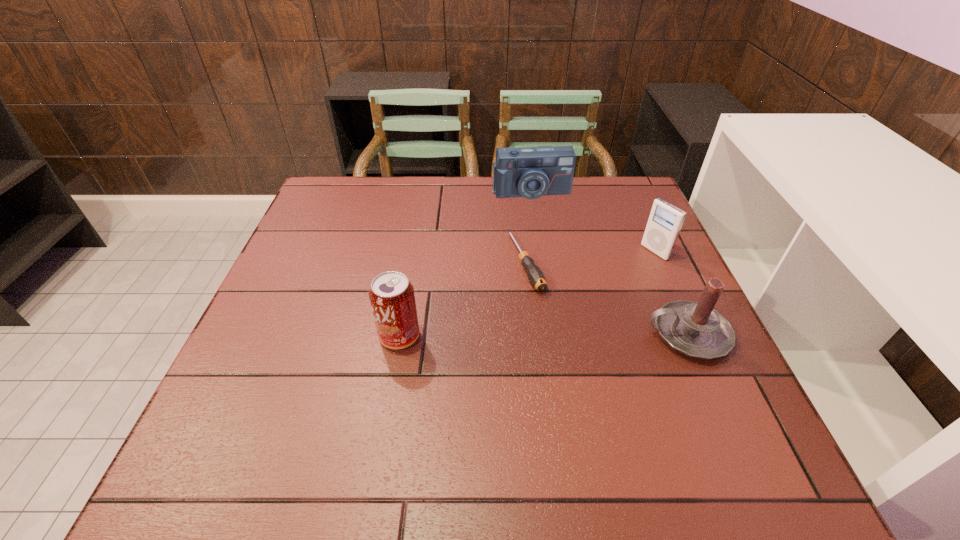
Locate an element on the screen. vacant space on the desktop that is between the soda can and the candle and is positioned on the front-facing side of the iPod is located at coordinates (506, 335).

Image resolution: width=960 pixels, height=540 pixels. In order to click on free spot on the desktop that is between the leftmost object and the candle and is positioned at the tip of the shortest object in this screenshot , I will do `click(567, 335)`.

Locate an element on the screen. Image resolution: width=960 pixels, height=540 pixels. free space on the desktop that is between the leftmost object and the candle and is positioned on the lens of the farthest object is located at coordinates (569, 335).